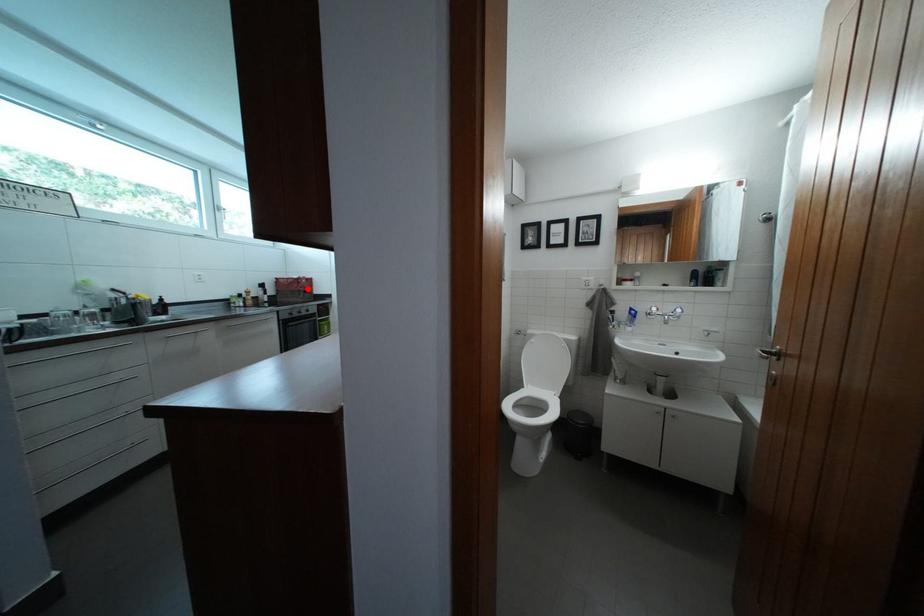
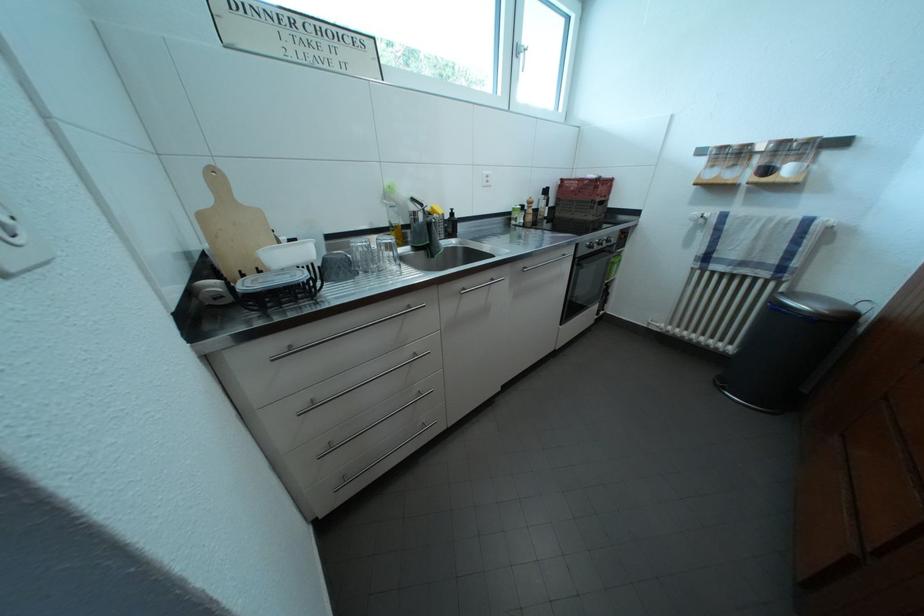
Question: I am providing you with two images of the same scene from different viewpoints. A red point is shown in image1. For the corresponding object point in image2, is it positioned nearer or farther from the camera?

Choices:
 (A) Nearer
 (B) Farther

Answer: (B)